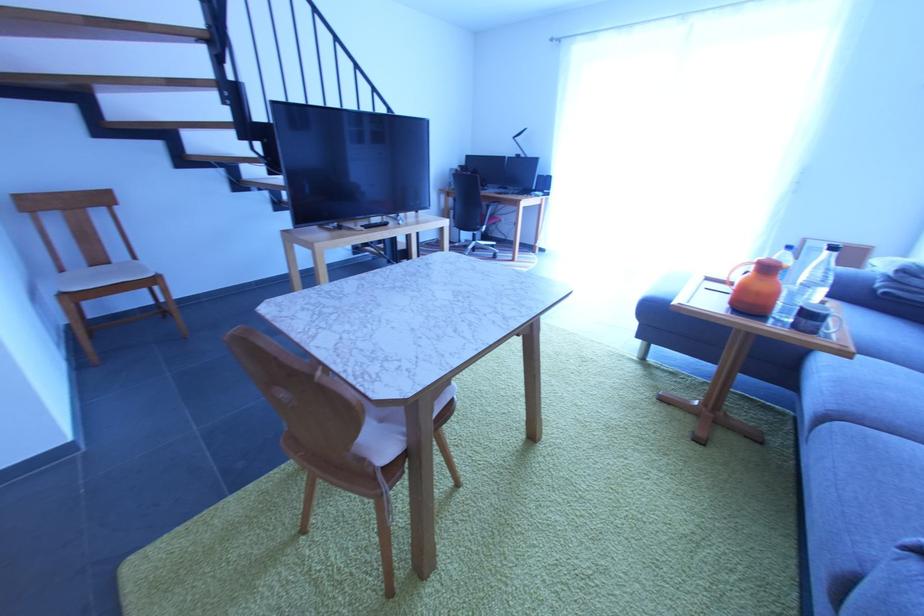
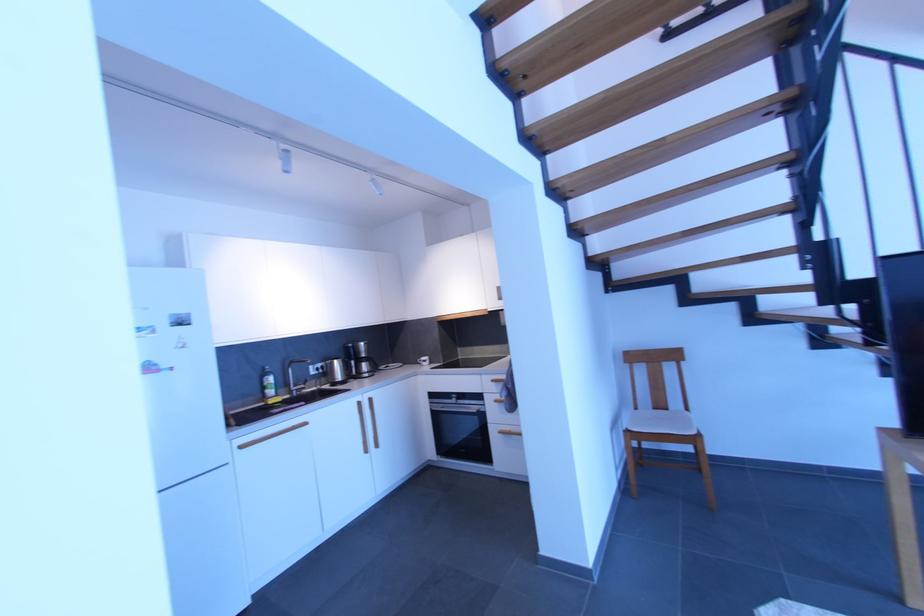
Question: The first image is from the beginning of the video and the second image is from the end. How did the camera likely rotate when shooting the video?

Choices:
 (A) Left
 (B) Right
 (C) Up
 (D) Down

Answer: (A)